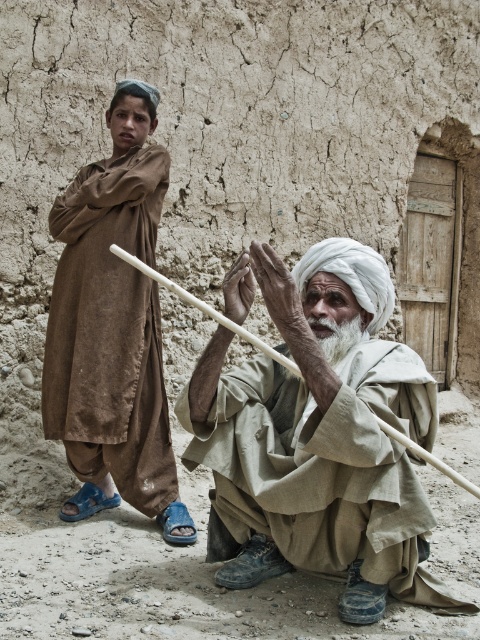
Based on the photo, who is more distant from viewer, (404, 483) or (133, 115)?

The point (133, 115) is more distant.

Which is more to the right, light beige fabric at center or brown cotton robe at left?

Positioned to the right is light beige fabric at center.

You are a GUI agent. You are given a task and a screenshot of the screen. Output one action in this format:
    pyautogui.click(x=<x>, y=<y>)
    Task: Click on the light beige fabric at center
    Image resolution: width=480 pixels, height=640 pixels.
    Given the screenshot: What is the action you would take?
    pyautogui.click(x=317, y=435)

This screenshot has width=480, height=640. Find the location of `light beige fabric at center`. light beige fabric at center is located at coordinates (317, 435).

What do you see at coordinates (317, 435) in the screenshot? I see `light beige fabric at center` at bounding box center [317, 435].

Is light beige fabric at center positioned before white soft beard at center?

Yes, light beige fabric at center is closer to the viewer.

Identify the location of light beige fabric at center. (317, 435).

Does brown cotton robe at left have a greater width compared to white soft beard at center?

Yes.

Can you confirm if brown cotton robe at left is thinner than white soft beard at center?

In fact, brown cotton robe at left might be wider than white soft beard at center.

Locate an element on the screen. The image size is (480, 640). brown cotton robe at left is located at coordinates (112, 328).

At what (x,y) coordinates should I click in order to perform the action: click on brown cotton robe at left. Please return your answer as a coordinate pair (x, y). Looking at the image, I should click on (112, 328).